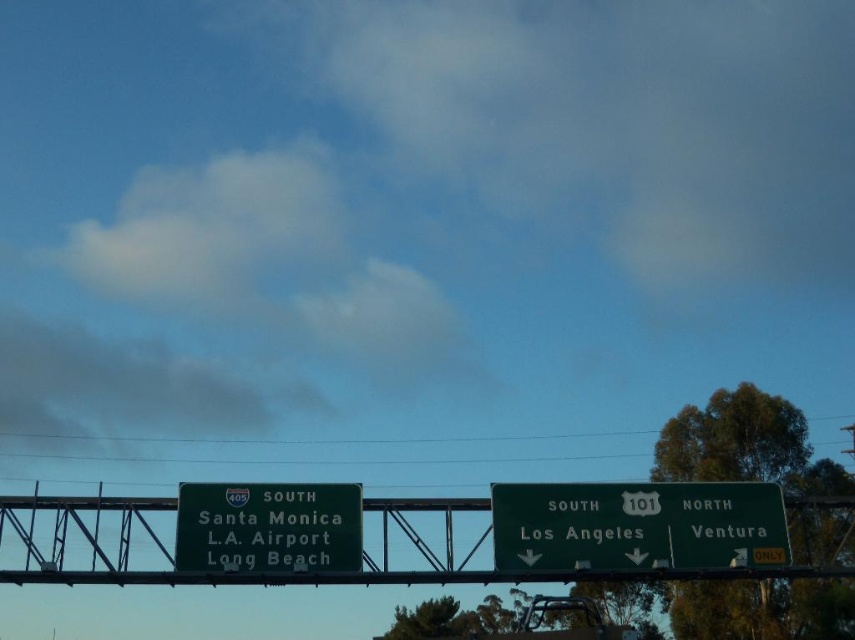
You are a driver approaching the highway overpass sign. You see the green metallic sign at center and the green metallic sign at lower left. Which one is positioned higher up on the sign structure?

The green metallic sign at lower left is positioned higher up on the sign structure than the green metallic sign at center.

You are a delivery driver who needs to read both the green metallic sign at center and the green matte sign at center while driving on the highway. Given that your vehicle is 2.5 meters wide, can you safely view both signs without changing lanes?

The green metallic sign at center and the green matte sign at center are 4.56 meters apart. Since your vehicle is 2.5 meters wide, the distance between the signs is wider than your vehicle, so you can safely view both signs without needing to change lanes.

You are a truck driver approaching the highway overpass sign. You need to read both the green matte sign at center and the green metallic sign at lower left. Which one do you need to look up to read?

The green matte sign at center is much taller than the green metallic sign at lower left, so you need to look up to read the green matte sign at center.